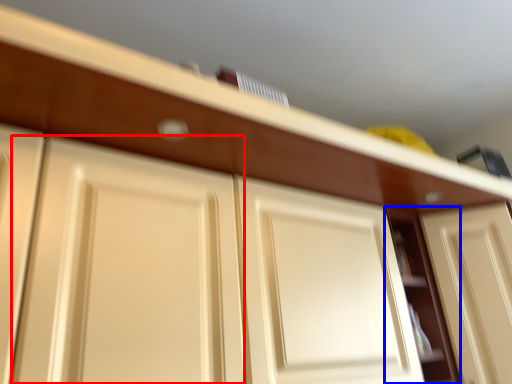
Question: Which object appears farthest to the camera in this image, door (highlighted by a red box) or cabinet (highlighted by a blue box)?

Choices:
 (A) door
 (B) cabinet

Answer: (B)